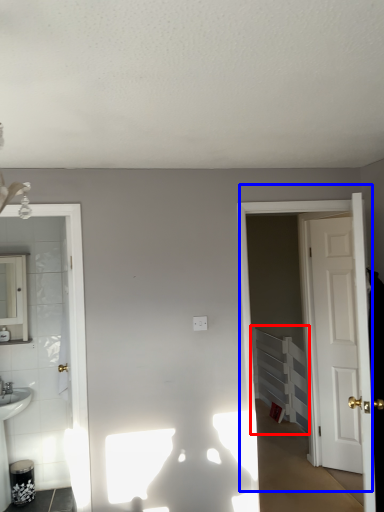
Question: Which point is further to the camera, radiator (highlighted by a red box) or door (highlighted by a blue box)?

Choices:
 (A) radiator
 (B) door

Answer: (A)